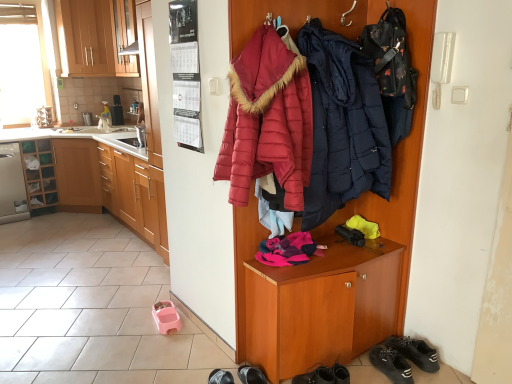
Identify the location of metallic stainless steel toaster at left. Image resolution: width=512 pixels, height=384 pixels. (117, 111).

Describe the element at coordinates (267, 120) in the screenshot. I see `quilted red jacket at center, which is counted as the 1th jacket, starting from the left` at that location.

The height and width of the screenshot is (384, 512). Describe the element at coordinates (343, 125) in the screenshot. I see `dark blue quilted jacket at center, the second jacket viewed from the left` at that location.

This screenshot has width=512, height=384. What are the coordinates of `wooden cabinet at left, the 2th cabinetry from the top` in the screenshot? It's located at (39, 174).

At what (x,y) coordinates should I click in order to perform the action: click on black suede sneakers at lower right, the 2th footwear when ordered from left to right. Please return your answer as a coordinate pair (x, y). Looking at the image, I should click on (403, 358).

In the scene shown: Is matte wood cabinets at upper left, positioned as the second cabinetry in left-to-right order, beside black leather shoe at lower center, the second footwear positioned from the right?

No, matte wood cabinets at upper left, positioned as the second cabinetry in left-to-right order, is not beside black leather shoe at lower center, the second footwear positioned from the right.

Is matte wood cabinets at upper left, which is counted as the first cabinetry, starting from the top, smaller than black leather shoe at lower center, the 1th footwear when ordered from left to right?

No.

From a real-world perspective, is wooden cabinet at left, the 2th cabinetry in the bottom-to-top sequence, located higher than metallic stainless steel toaster at left?

No.

Is wooden cabinet at left, which is the 3th cabinetry in right-to-left order, far away from metallic stainless steel toaster at left?

That's right, there is a large distance between wooden cabinet at left, which is the 3th cabinetry in right-to-left order, and metallic stainless steel toaster at left.

Can you confirm if wooden cabinet at left, which is the 3th cabinetry in right-to-left order, is shorter than metallic stainless steel toaster at left?

In fact, wooden cabinet at left, which is the 3th cabinetry in right-to-left order, may be taller than metallic stainless steel toaster at left.

Which is in front, point (47, 179) or point (116, 105)?

Positioned in front is point (47, 179).

Is wooden cabinet at right taller or shorter than black suede sneakers at lower right, the 2th footwear when ordered from left to right?

wooden cabinet at right is taller than black suede sneakers at lower right, the 2th footwear when ordered from left to right.

Find the location of a particular element. the 1st footwear positioned below the wooden cabinet at right (from a real-world perspective) is located at coordinates (403, 358).

Measure the distance between wooden cabinet at left, acting as the third cabinetry starting from the top, and black leather shoe at lower center, the 1th footwear when ordered from left to right.

wooden cabinet at left, acting as the third cabinetry starting from the top, is 1.91 meters from black leather shoe at lower center, the 1th footwear when ordered from left to right.

You are a GUI agent. You are given a task and a screenshot of the screen. Output one action in this format:
    pyautogui.click(x=<x>, y=<y>)
    Task: Click on the cabinetry that is the 1st one when counting upward from the black leather shoe at lower center, the second footwear positioned from the right (from the image's perspective)
    
    Given the screenshot: What is the action you would take?
    pyautogui.click(x=135, y=196)

From the image's perspective, does wooden cabinet at left, acting as the 1th cabinetry starting from the bottom, appear lower than black leather shoe at lower center, the 1th footwear when ordered from left to right?

No, from the image's perspective, wooden cabinet at left, acting as the 1th cabinetry starting from the bottom, is not below black leather shoe at lower center, the 1th footwear when ordered from left to right.

Is wooden cabinet at left, acting as the third cabinetry starting from the top, not within black leather shoe at lower center, the second footwear positioned from the right?

Yes, wooden cabinet at left, acting as the third cabinetry starting from the top, is outside of black leather shoe at lower center, the second footwear positioned from the right.

Consider the image. Considering the sizes of objects wooden cabinet at left, acting as the third cabinetry starting from the top, and wooden cabinet at left, which ranks as the 1th cabinetry in left-to-right order, in the image provided, who is shorter, wooden cabinet at left, acting as the third cabinetry starting from the top, or wooden cabinet at left, which ranks as the 1th cabinetry in left-to-right order,?

wooden cabinet at left, which ranks as the 1th cabinetry in left-to-right order, is shorter.

From a real-world perspective, relative to wooden cabinet at left, which is the 3th cabinetry in right-to-left order, is wooden cabinet at left, the 3th cabinetry from the left, vertically above or below?

In terms of real-world spatial position, wooden cabinet at left, the 3th cabinetry from the left, is below wooden cabinet at left, which is the 3th cabinetry in right-to-left order.

Is wooden cabinet at left, the 2th cabinetry in the bottom-to-top sequence, inside wooden cabinet at left, which ranks as the first cabinetry in right-to-left order?

No, wooden cabinet at left, the 2th cabinetry in the bottom-to-top sequence, is not a part of wooden cabinet at left, which ranks as the first cabinetry in right-to-left order.

The height and width of the screenshot is (384, 512). Find the location of `cabinetry in front of the wooden cabinet at left, the 2th cabinetry from the top`. cabinetry in front of the wooden cabinet at left, the 2th cabinetry from the top is located at coordinates (135, 196).

From the image's perspective, between wooden cabinet at left, the 2th cabinetry in the bottom-to-top sequence, and dark blue quilted jacket at center, the second jacket viewed from the left, who is located below?

wooden cabinet at left, the 2th cabinetry in the bottom-to-top sequence, from the image's perspective.

Is point (51, 200) positioned in front of point (326, 112)?

No.

The image size is (512, 384). Find the location of `the 2nd jacket counting from the right of the wooden cabinet at left, the 2th cabinetry in the bottom-to-top sequence`. the 2nd jacket counting from the right of the wooden cabinet at left, the 2th cabinetry in the bottom-to-top sequence is located at coordinates (343, 125).

Who is shorter, wooden cabinet at left, which ranks as the 1th cabinetry in left-to-right order, or dark blue quilted jacket at center, arranged as the first jacket when viewed from the right?

wooden cabinet at left, which ranks as the 1th cabinetry in left-to-right order, is shorter.

How distant is dark blue quilted jacket at center, the second jacket viewed from the left, from metallic stainless steel toaster at left?

They are 12.09 feet apart.

Is dark blue quilted jacket at center, the second jacket viewed from the left, situated inside metallic stainless steel toaster at left or outside?

dark blue quilted jacket at center, the second jacket viewed from the left, is not enclosed by metallic stainless steel toaster at left.

Is dark blue quilted jacket at center, arranged as the first jacket when viewed from the right, wider than metallic stainless steel toaster at left?

Yes.

Based on the photo, between dark blue quilted jacket at center, the second jacket viewed from the left, and metallic stainless steel toaster at left, which one has more height?

dark blue quilted jacket at center, the second jacket viewed from the left.

From a real-world perspective, starting from the black leather shoe at lower center, the second footwear positioned from the right, which cabinetry is the 3rd one vertically above it? Please provide its 2D coordinates.

[(96, 37)]

The image size is (512, 384). I want to click on the 2nd cabinetry counting from the left of the metallic stainless steel toaster at left, so click(39, 174).

Looking at the image, which one is located closer to wooden cabinet at left, the 2th cabinetry in the bottom-to-top sequence, satin silver dishwasher at left or matte wood cabinets at upper left, positioned as the second cabinetry in left-to-right order?

Based on the image, satin silver dishwasher at left appears to be nearer to wooden cabinet at left, the 2th cabinetry in the bottom-to-top sequence.

Based on their spatial positions, is wooden cabinet at left, which is the 3th cabinetry in right-to-left order, or matte wood cabinets at upper left, which is counted as the first cabinetry, starting from the top, further from metallic stainless steel toaster at left?

wooden cabinet at left, which is the 3th cabinetry in right-to-left order, lies further to metallic stainless steel toaster at left than the other object.

Estimate the real-world distances between objects in this image. Which object is closer to matte wood cabinets at upper left, the 3th cabinetry ordered from the bottom, wooden cabinet at left, the 2th cabinetry in the bottom-to-top sequence, or satin silver dishwasher at left?

wooden cabinet at left, the 2th cabinetry in the bottom-to-top sequence, lies closer to matte wood cabinets at upper left, the 3th cabinetry ordered from the bottom, than the other object.

When comparing their distances from matte wood cabinets at upper left, positioned as the second cabinetry in left-to-right order, does satin silver dishwasher at left or metallic stainless steel toaster at left seem further?

Among the two, satin silver dishwasher at left is located further to matte wood cabinets at upper left, positioned as the second cabinetry in left-to-right order.

When comparing their distances from black suede sneakers at lower right, which is the first footwear in right-to-left order, does metallic stainless steel toaster at left or dark blue quilted jacket at center, arranged as the first jacket when viewed from the right, seem closer?

Among the two, dark blue quilted jacket at center, arranged as the first jacket when viewed from the right, is located nearer to black suede sneakers at lower right, which is the first footwear in right-to-left order.

When comparing their distances from wooden cabinet at left, acting as the 1th cabinetry starting from the bottom, does matte wood cabinets at upper left, placed as the second cabinetry when sorted from right to left, or wooden cabinet at left, the 2th cabinetry in the bottom-to-top sequence, seem further?

The object further to wooden cabinet at left, acting as the 1th cabinetry starting from the bottom, is matte wood cabinets at upper left, placed as the second cabinetry when sorted from right to left.

Considering their positions, is wooden cabinet at left, which ranks as the 1th cabinetry in left-to-right order, positioned further to transparent glass window at upper left than wooden cabinet at right?

wooden cabinet at right lies further to transparent glass window at upper left than the other object.

Based on their spatial positions, is black leather shoe at lower center, the second footwear positioned from the right, or metallic stainless steel toaster at left further from wooden cabinet at right?

Based on the image, metallic stainless steel toaster at left appears to be further to wooden cabinet at right.

Locate an element on the screen. footwear between matte wood cabinets at upper left, which is counted as the first cabinetry, starting from the top, and black leather shoe at lower center, the 1th footwear when ordered from left to right, in the vertical direction is located at coordinates (403, 358).

Identify the location of cupboard between transparent glass window at upper left and dark blue quilted jacket at center, arranged as the first jacket when viewed from the right. Image resolution: width=512 pixels, height=384 pixels. (402, 154).

Image resolution: width=512 pixels, height=384 pixels. What are the coordinates of `window screen between satin silver dishwasher at left and dark blue quilted jacket at center, the second jacket viewed from the left, in the horizontal direction` in the screenshot? It's located at (22, 63).

You are a GUI agent. You are given a task and a screenshot of the screen. Output one action in this format:
    pyautogui.click(x=<x>, y=<y>)
    Task: Click on the cupboard between quilted red jacket at center, which is counted as the 1th jacket, starting from the left, and black leather shoe at lower center, the 1th footwear when ordered from left to right, from top to bottom
    The image size is (512, 384).
    Given the screenshot: What is the action you would take?
    pyautogui.click(x=402, y=154)